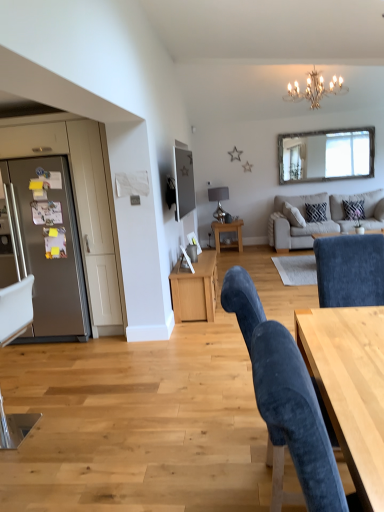
This screenshot has width=384, height=512. I want to click on free space to the left of velvet blue chair at lower right, which is the second chair from left to right, so click(x=193, y=471).